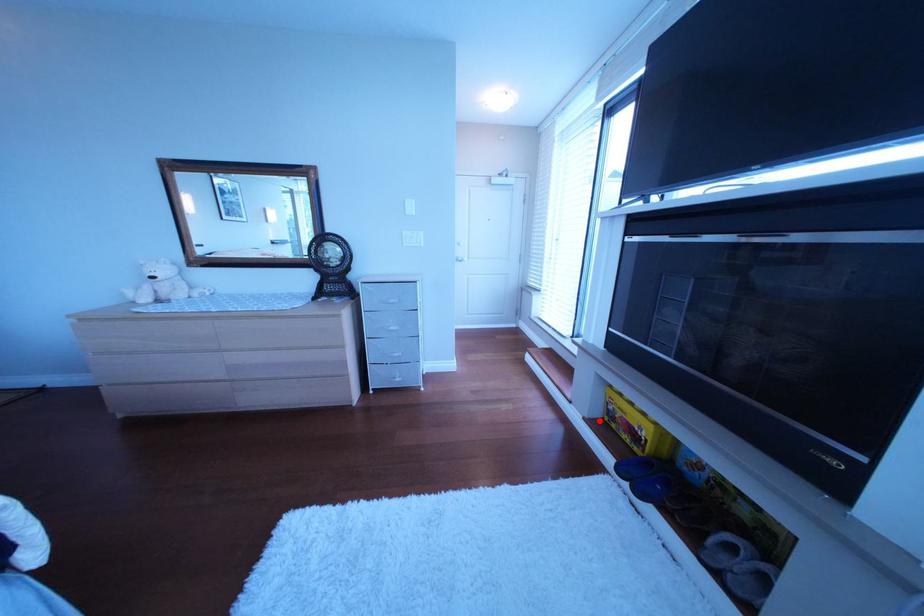
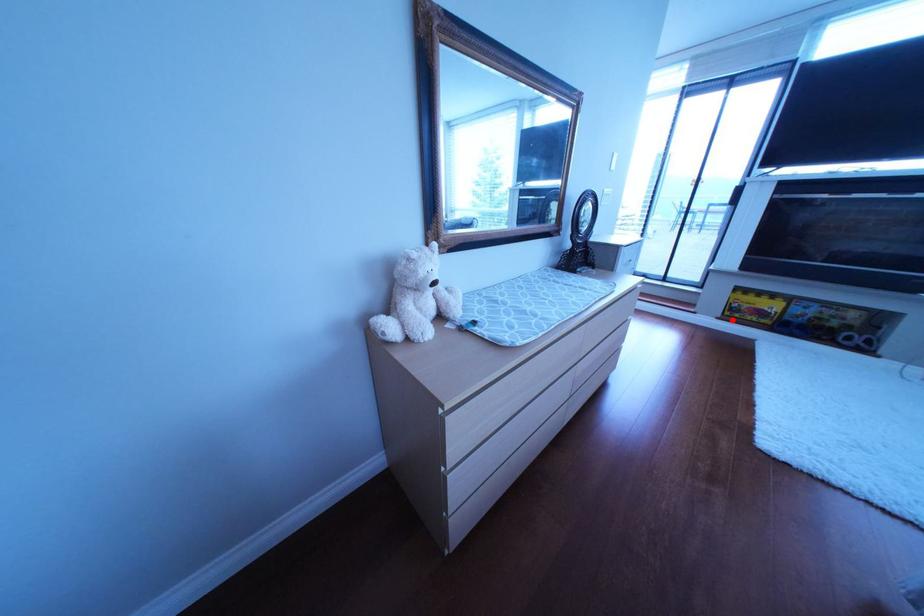
I am providing you with two images of the same scene from different viewpoints. A red point is marked on the first image and another point is marked on the second image. Is the red point in image1 aligned with the point shown in image2?

Yes